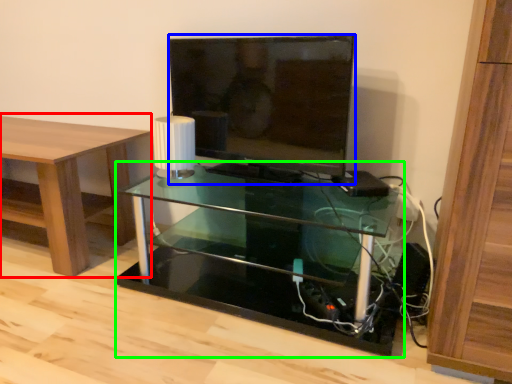
Question: Which object is the closest to the table (highlighted by a red box)? Choose among these: television (highlighted by a blue box) or shelf (highlighted by a green box).

Choices:
 (A) television
 (B) shelf

Answer: (B)